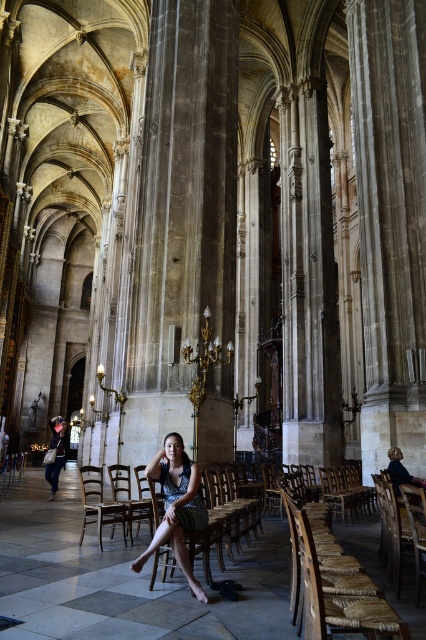
You are standing at the entrance of the cathedral and see the wooden polished chair at center and the matte black dress at lower left. Which object is closer to the ceiling?

The wooden polished chair at center is closer to the ceiling because it is positioned above the matte black dress at lower left.

You are a visitor in the cathedral and want to sit down. There is a wooden polished chair at center and a matte black dress at lower left. Which object can you sit on?

The wooden polished chair at center is smaller than the matte black dress at lower left, so the wooden polished chair at center is the only object you can sit on.